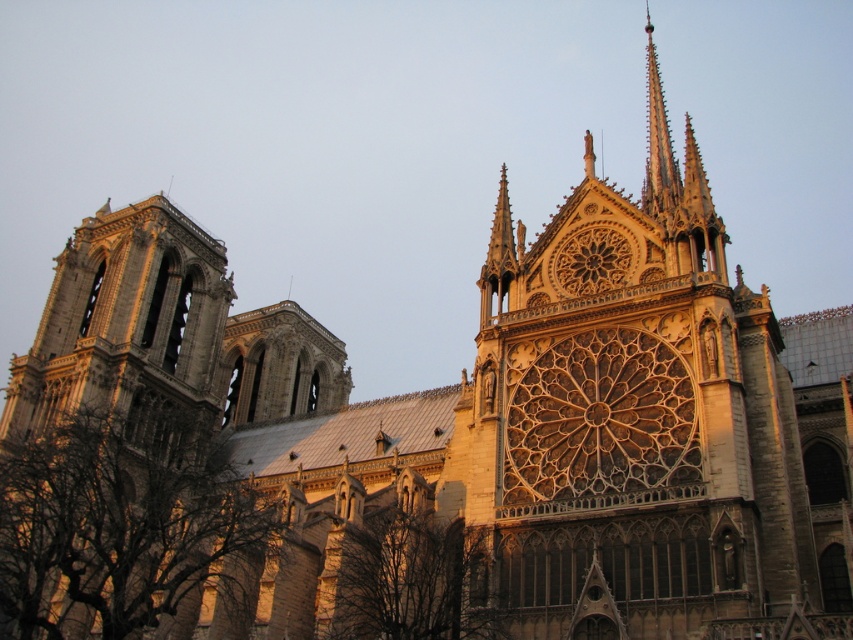
Which of these two, brown leafless branches at lower left or brown leafless tree at lower center, stands shorter?

Standing shorter between the two is brown leafless tree at lower center.

Does point (199, 520) come farther from viewer compared to point (347, 605)?

Yes.

Between point (49, 554) and point (380, 524), which one is positioned in front?

Point (49, 554)

Find the location of `brown leafless branches at lower left`. brown leafless branches at lower left is located at coordinates 119,522.

Can you confirm if brown leafless branches at lower left is thinner than golden stone spire at upper right?

Indeed, brown leafless branches at lower left has a lesser width compared to golden stone spire at upper right.

Does brown leafless branches at lower left have a smaller size compared to golden stone spire at upper right?

Correct, brown leafless branches at lower left occupies less space than golden stone spire at upper right.

Between point (169, 509) and point (662, 113), which one is positioned in front?

Point (169, 509) is more forward.

Where is `brown leafless branches at lower left`? The width and height of the screenshot is (853, 640). brown leafless branches at lower left is located at coordinates (119, 522).

Who is more distant from viewer, (247,492) or (109,403)?

The point (109,403) is more distant.

Which is below, brown leafless branches at lower left or stone tower at left?

brown leafless branches at lower left is lower down.

Which is in front, point (103, 429) or point (134, 381)?

Point (103, 429) is more forward.

I want to click on brown leafless branches at lower left, so click(x=119, y=522).